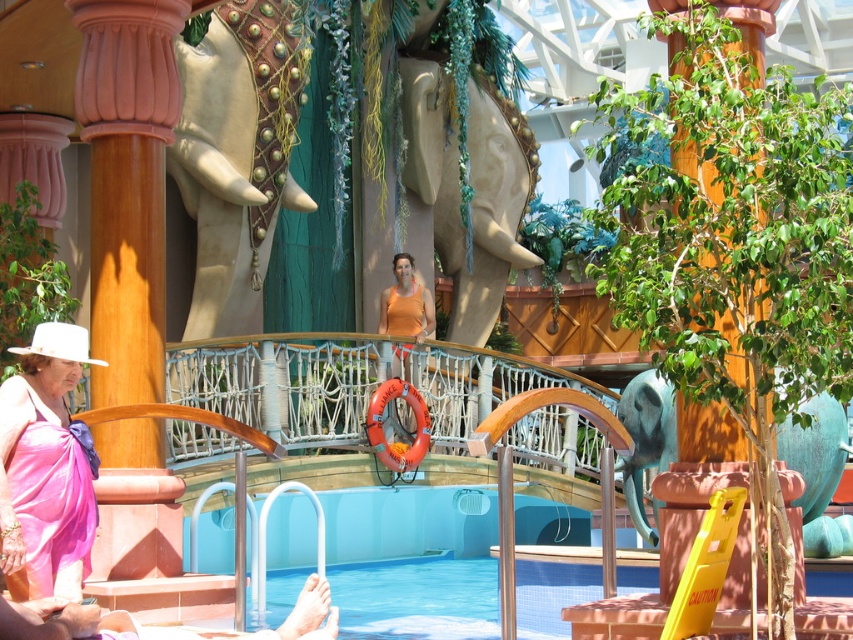
You are standing in the indoor pool area and want to move from the point at coordinates point (35,432) to the point at coordinates point (683,164). Which direction should you walk to get closer to your destination?

Since point (35,432) is further to the viewer than point (683,164), you should walk towards the background of the scene to reach point (683,164).

You are a guest at the resort and spot a pink satin dress at lower left and a green leafy plant at center. Which object is taller?

The green leafy plant at center is taller than the pink satin dress at lower left.

You are a guest at the resort and want to place a pink satin dress at lower left and a green leafy plant at center on a narrow shelf. Which item can fit better on the shelf if the shelf can only accommodate thin objects?

The pink satin dress at lower left is thinner than the green leafy plant at center, so it can fit better on the narrow shelf.